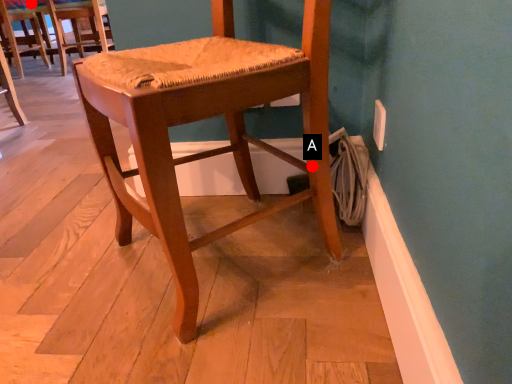
Question: Two points are circled on the image, labeled by A and B beside each circle. Among these points, which one is nearest to the camera?

Choices:
 (A) A is closer
 (B) B is closer

Answer: (A)